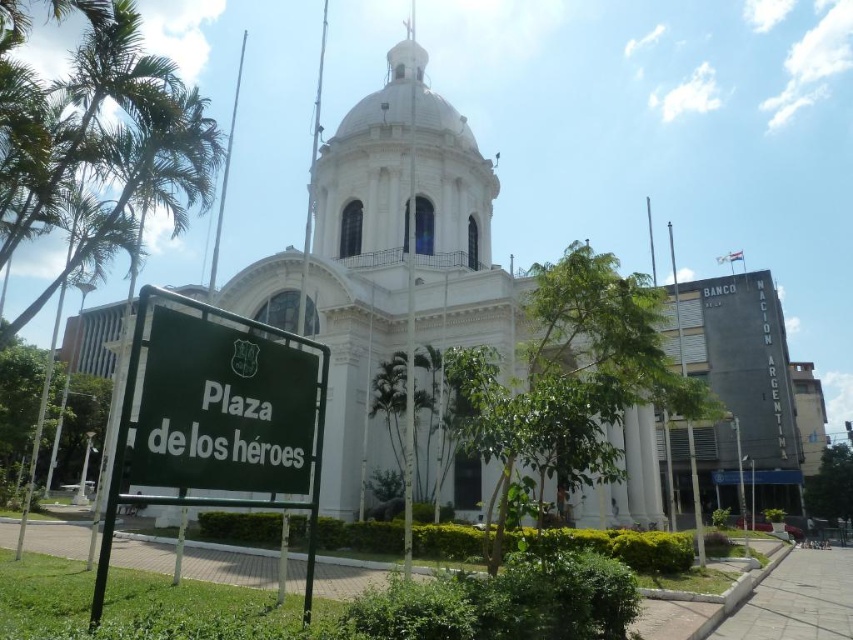
Question: Considering the real-world distances, which object is closest to the green metal/plastic sign at lower left?

Choices:
 (A) white marble church at center
 (B) green matte sign at lower left

Answer: (B)

Question: Where is white marble church at center located in relation to green matte sign at lower left in the image?

Choices:
 (A) above
 (B) below

Answer: (A)

Question: Among these points, which one is nearest to the camera?

Choices:
 (A) [279, 458]
 (B) [239, 445]
 (C) [393, 305]

Answer: (B)

Question: Is white marble church at center below green metal/plastic sign at lower left?

Choices:
 (A) yes
 (B) no

Answer: (B)

Question: Does white marble church at center appear on the right side of green matte sign at lower left?

Choices:
 (A) yes
 (B) no

Answer: (B)

Question: Which of these objects is positioned closest to the green matte sign at lower left?

Choices:
 (A) green metal/plastic sign at lower left
 (B) white marble church at center

Answer: (A)